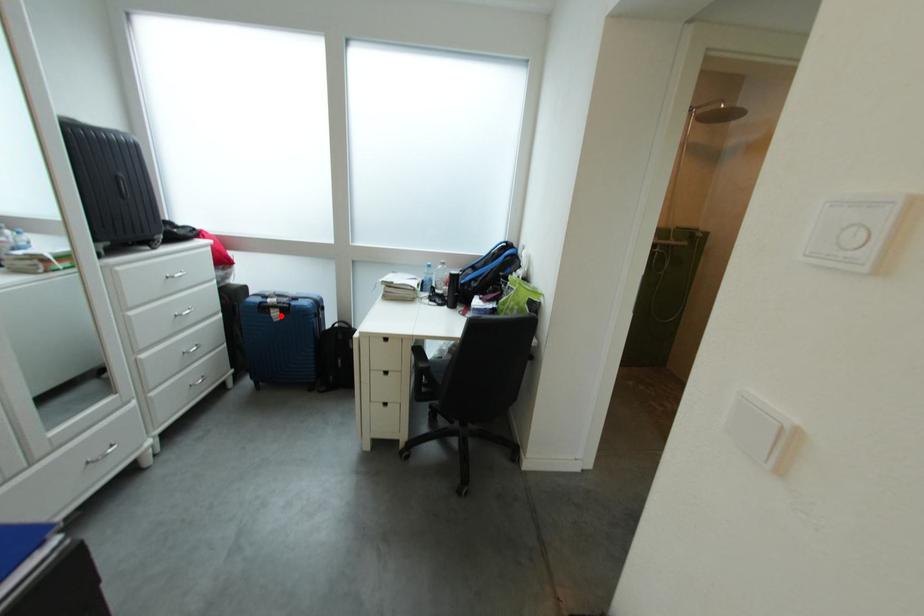
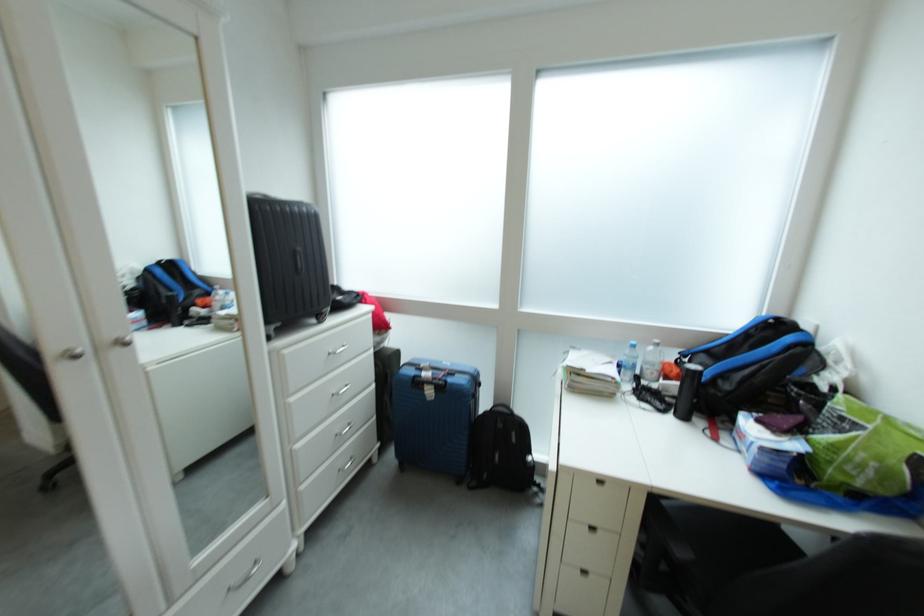
Question: I am providing you with two images of the same scene from different viewpoints. A red point is shown in image1. For the corresponding object point in image2, is it positioned nearer or farther from the camera?

Choices:
 (A) Nearer
 (B) Farther

Answer: (B)